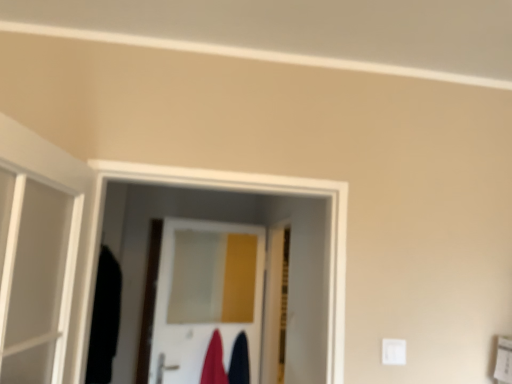
Question: Relative to velvet-like red robe at center, the 1th robe positioned from the left, is white glossy door at center, the first door in the left-to-right sequence, in front or behind?

Choices:
 (A) behind
 (B) front

Answer: (B)

Question: From a real-world perspective, is white glossy door at center, the first door in the left-to-right sequence, physically located above or below velvet-like red robe at center, acting as the 2th robe starting from the right?

Choices:
 (A) below
 (B) above

Answer: (B)

Question: Based on their relative distances, which object is nearer to the velvet-like red robe at center, the 1th robe positioned from the left?

Choices:
 (A) white glossy door at center, which is counted as the 2th door, starting from the right
 (B) velvet dark blue robe at center, placed as the 1th robe when sorted from right to left
 (C) wooden door at center, which ranks as the 1th door in right-to-left order

Answer: (B)

Question: Based on their relative distances, which object is nearer to the wooden door at center, which ranks as the 1th door in right-to-left order?

Choices:
 (A) velvet dark blue robe at center, placed as the 1th robe when sorted from right to left
 (B) velvet-like red robe at center, the 1th robe positioned from the left
 (C) white glossy door at center, which is counted as the 2th door, starting from the right

Answer: (C)